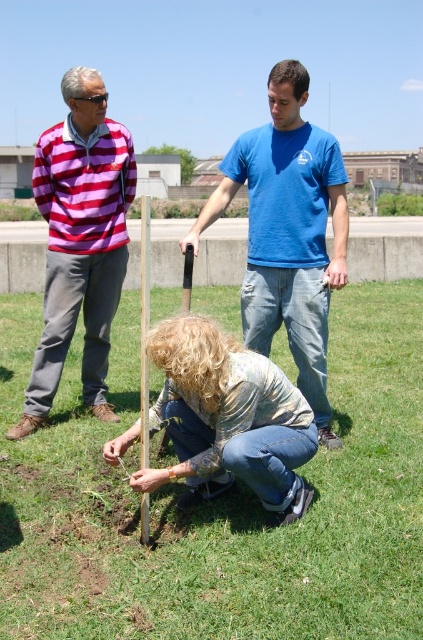
In the scene shown: Based on the coordinates provided, what is the color of the area at point (219, 502) in the image?

The area at point (219, 502) is green grass according to the coordinates provided.

You are standing in the park and see the green grass at center and the striped cotton shirt at left. Which one is nearer to you?

The green grass at center is closer to the viewer than the striped cotton shirt at left.

In the scene shown: You are a photographer trying to capture the scene where the woman in the blue cotton shirt at center is planting a tree. If you want to frame her exactly at the center of your photo, which coordinates should you aim for?

You should aim for the coordinates point (288, 232) where the blue cotton shirt at center is located.